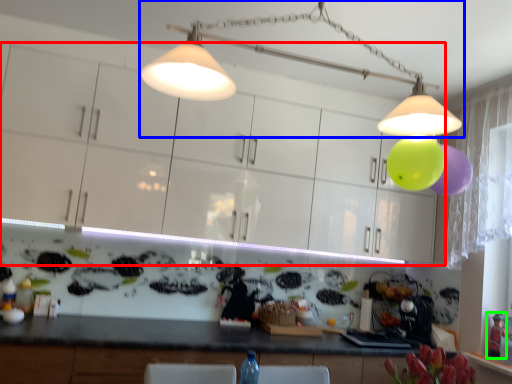
Question: Which object is positioned closest to cabinetry (highlighted by a red box)? Select from lamp (highlighted by a blue box) and toy (highlighted by a green box).

Choices:
 (A) lamp
 (B) toy

Answer: (A)